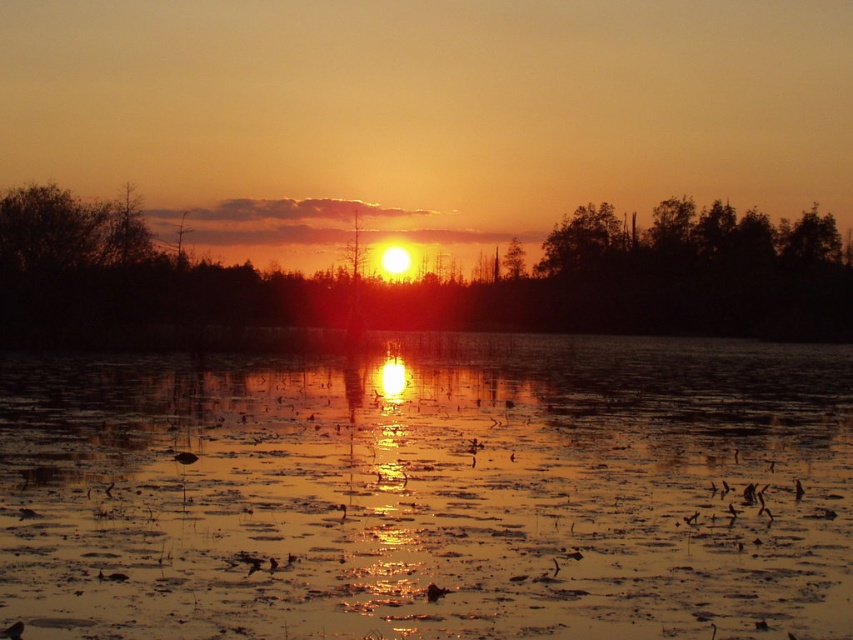
Does silhouette tree at center have a lesser width compared to green matte tree at upper right?

No.

Who is positioned more to the left, silhouette tree at center or green matte tree at upper right?

From the viewer's perspective, silhouette tree at center appears more on the left side.

Which is behind, point (16, 241) or point (567, 248)?

The point (567, 248) is more distant.

You are a GUI agent. You are given a task and a screenshot of the screen. Output one action in this format:
    pyautogui.click(x=<x>, y=<y>)
    Task: Click on the silhouette tree at center
    This screenshot has height=640, width=853.
    Given the screenshot: What is the action you would take?
    tap(436, 280)

Is point (346, 536) positioned after point (605, 220)?

No, it is in front of (605, 220).

Is golden reflective water at center smaller than green matte tree at upper right?

Actually, golden reflective water at center might be larger than green matte tree at upper right.

Where is `golden reflective water at center`? The width and height of the screenshot is (853, 640). golden reflective water at center is located at coordinates (431, 492).

Where is `golden reflective water at center`? This screenshot has height=640, width=853. golden reflective water at center is located at coordinates (431, 492).

This screenshot has width=853, height=640. In order to click on golden reflective water at center in this screenshot , I will do `click(431, 492)`.